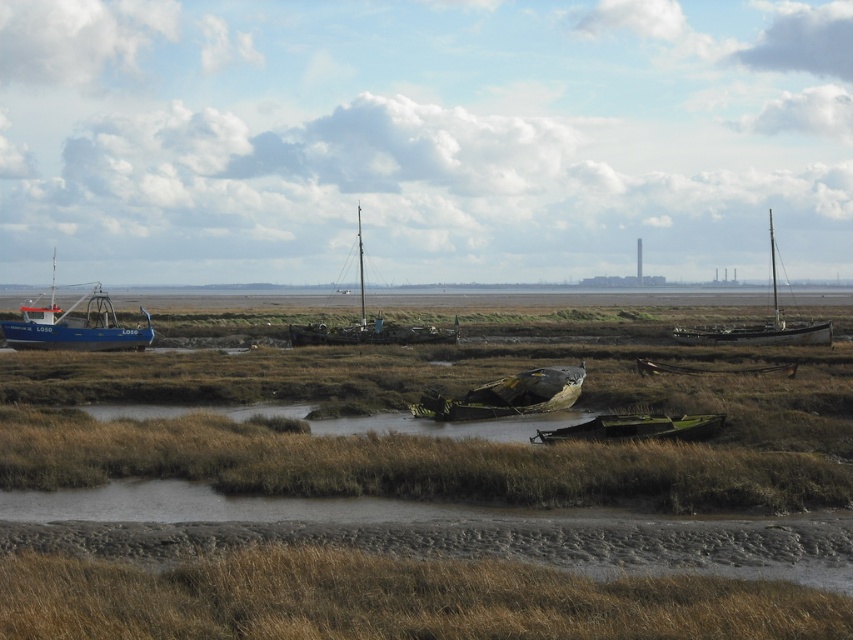
Can you confirm if brown dry grass at center is wider than green matte boat at center?

Yes.

What do you see at coordinates (409, 506) in the screenshot? I see `brown dry grass at center` at bounding box center [409, 506].

Locate an element on the screen. brown dry grass at center is located at coordinates (409, 506).

Can you confirm if brown dry grass at lower center is positioned to the right of green matte boat at center?

No, brown dry grass at lower center is not to the right of green matte boat at center.

Which is behind, point (665, 602) or point (711, 420)?

The point (711, 420) is behind.

Is point (160, 588) positioned before point (711, 435)?

Yes, point (160, 588) is in front of point (711, 435).

At what (x,y) coordinates should I click in order to perform the action: click on brown dry grass at lower center. Please return your answer as a coordinate pair (x, y). This screenshot has width=853, height=640. Looking at the image, I should click on pos(393,600).

Does brown dry grass at center have a larger size compared to brown dry grass at lower center?

Yes.

Is point (566, 476) positioned before point (189, 564)?

No, it is not.

Locate an element on the screen. The height and width of the screenshot is (640, 853). brown dry grass at center is located at coordinates (409, 506).